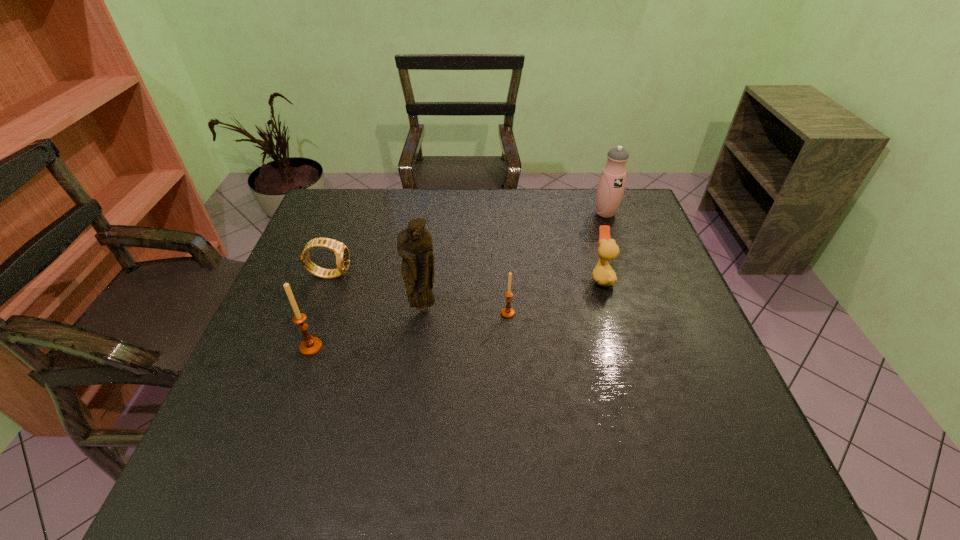
This screenshot has width=960, height=540. What are the coordinates of `free space located 0.380m on the back of the nearest object` in the screenshot? It's located at (348, 240).

Where is `free location located 0.230m on the right of the farther candle_holder`? free location located 0.230m on the right of the farther candle_holder is located at coordinates (607, 313).

Locate an element on the screen. Image resolution: width=960 pixels, height=540 pixels. vacant space located 0.360m on the front of the thermos bottle is located at coordinates (637, 303).

Locate an element on the screen. The image size is (960, 540). vacant space situated 0.210m on the front-facing side of the tallest object is located at coordinates (414, 387).

At what (x,y) coordinates should I click in order to perform the action: click on free space located 0.100m on the beak of the duck. Please return your answer as a coordinate pair (x, y). Looking at the image, I should click on (554, 278).

Where is `vacant space located 0.160m on the beak of the duck`? The height and width of the screenshot is (540, 960). vacant space located 0.160m on the beak of the duck is located at coordinates (532, 278).

I want to click on free space located 0.220m on the beak of the duck, so click(x=510, y=278).

Locate an element on the screen. vacant space located on the face of the watch is located at coordinates (417, 274).

Identify the location of object at the far edge. (611, 185).

At what (x,y) coordinates should I click in order to perform the action: click on candle_holder located at the left edge. Please return your answer as a coordinate pair (x, y). The image size is (960, 540). Looking at the image, I should click on (310, 346).